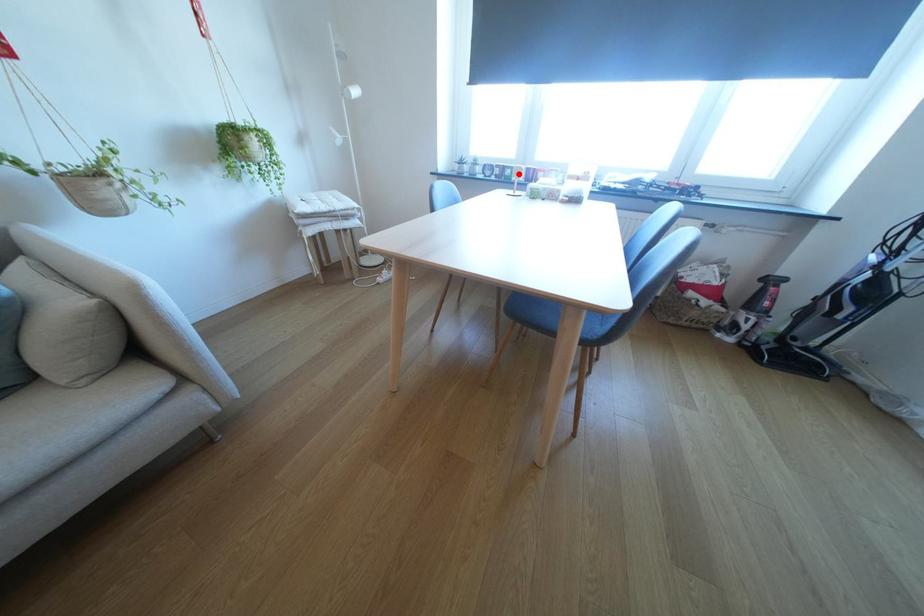
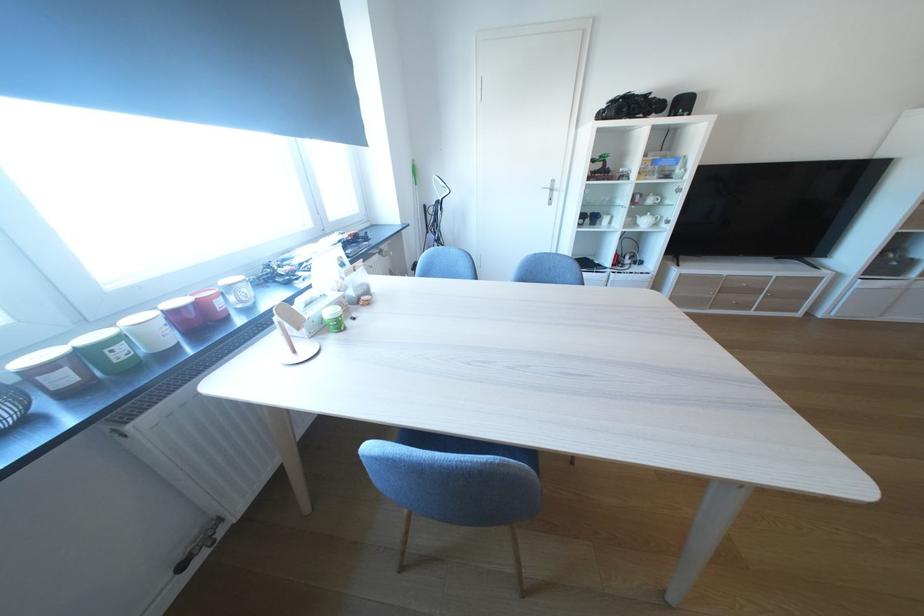
Question: I am providing you with two images of the same scene from different viewpoints. Given a red point in image1, look at the same physical point in image2. Is it:

Choices:
 (A) Closer to the viewpoint
 (B) Farther from the viewpoint

Answer: (B)